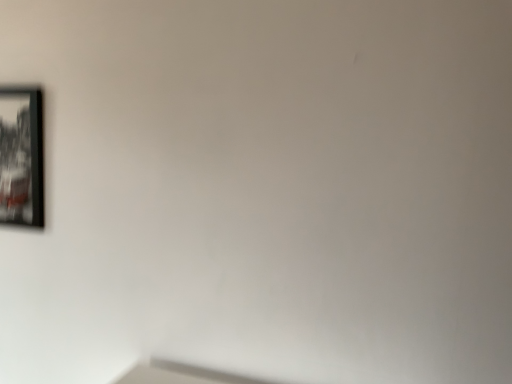
You are a GUI agent. You are given a task and a screenshot of the screen. Output one action in this format:
    pyautogui.click(x=<x>, y=<y>)
    Task: Click on the black matte picture frame at upper left
    This screenshot has width=512, height=384.
    Given the screenshot: What is the action you would take?
    pyautogui.click(x=21, y=157)

Measure the distance between black matte picture frame at upper left and camera.

They are 4.34 feet apart.

Based on the photo, what is the approximate height of black matte picture frame at upper left?

black matte picture frame at upper left is 44.07 centimeters in height.

In order to face black matte picture frame at upper left, should I rotate leftwards or rightwards?

Turn left approximately 29.104 degrees to face it.

Describe the element at coordinates (21, 157) in the screenshot. Image resolution: width=512 pixels, height=384 pixels. I see `black matte picture frame at upper left` at that location.

Locate an element on the screen. Image resolution: width=512 pixels, height=384 pixels. black matte picture frame at upper left is located at coordinates (21, 157).